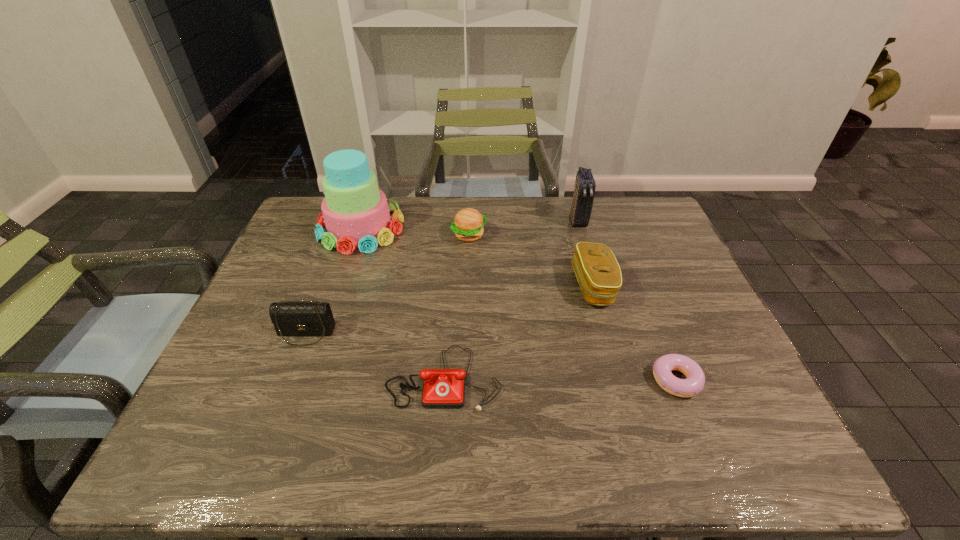
What are the coordinates of `object that is the nearest to the fifth farthest object` in the screenshot? It's located at (442, 388).

Locate an element on the screen. This screenshot has width=960, height=540. object that ranks as the second closest to the second shortest object is located at coordinates (598, 273).

Select which clutch bag appears as the third closest to the hamburger. Please provide its 2D coordinates. Your answer should be formatted as a tuple, i.e. [(x, y)], where the tuple contains the x and y coordinates of a point satisfying the conditions above.

[(290, 318)]

Select which clutch bag is the second closest to the second tallest object. Please provide its 2D coordinates. Your answer should be formatted as a tuple, i.e. [(x, y)], where the tuple contains the x and y coordinates of a point satisfying the conditions above.

[(290, 318)]

Where is `vacant region that satisfies the following two spatial constraints: 1. with the zip open on the second tallest object; 2. on the right side of the doughnut`? This screenshot has height=540, width=960. vacant region that satisfies the following two spatial constraints: 1. with the zip open on the second tallest object; 2. on the right side of the doughnut is located at coordinates (623, 380).

Identify the location of free space that satisfies the following two spatial constraints: 1. on the zipper side of the second farthest clutch bag; 2. on the left side of the doughnut. click(x=619, y=380).

The width and height of the screenshot is (960, 540). Identify the location of vacant space that satisfies the following two spatial constraints: 1. on the zipper side of the fourth nearest object; 2. on the dial of the telephone. (619, 377).

You are a GUI agent. You are given a task and a screenshot of the screen. Output one action in this format:
    pyautogui.click(x=<x>, y=<y>)
    Task: Click on the blank area in the image that satisfies the following two spatial constraints: 1. on the front flap of the third nearest object; 2. on the right side of the shortest object
    The height and width of the screenshot is (540, 960).
    Given the screenshot: What is the action you would take?
    pyautogui.click(x=288, y=380)